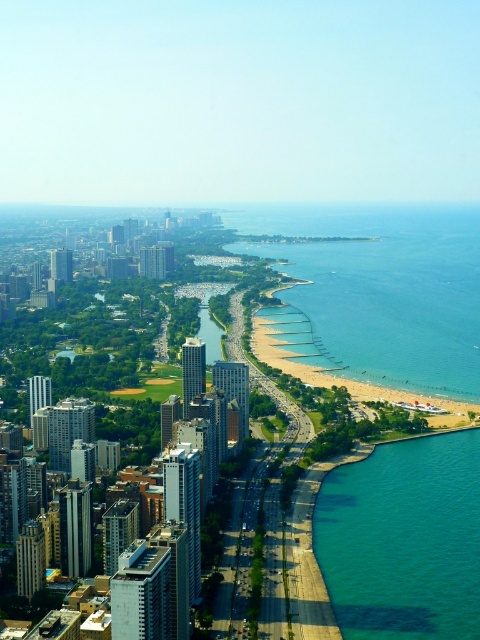
Is clear blue water at lower right positioned before teal glassy water at lower right?

Yes, it is.

Is clear blue water at lower right further to the viewer compared to teal glassy water at lower right?

No, clear blue water at lower right is closer to the viewer.

Where is `clear blue water at lower right`? This screenshot has height=640, width=480. clear blue water at lower right is located at coordinates (379, 291).